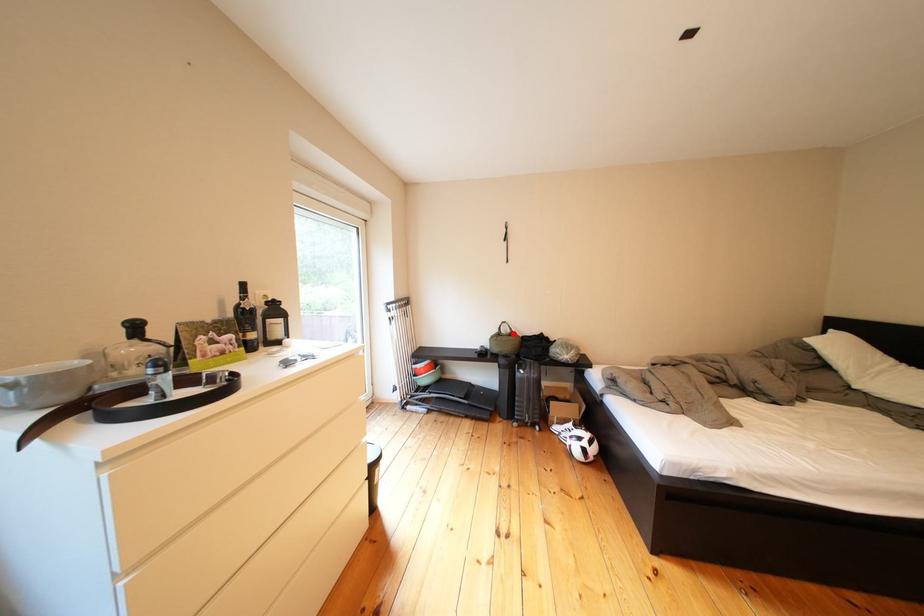
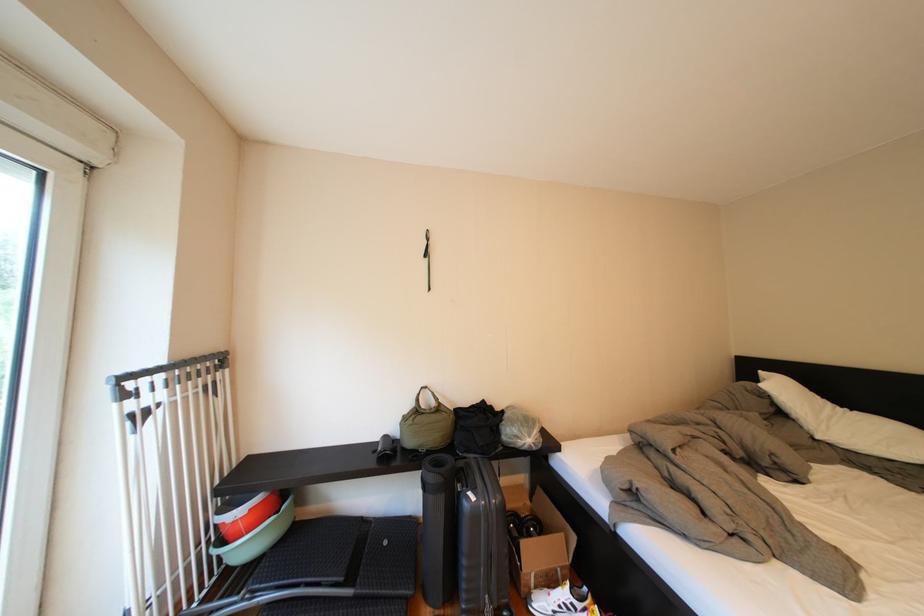
Find the pixel in the second image that matches the highlighted location in the first image.

(431, 405)